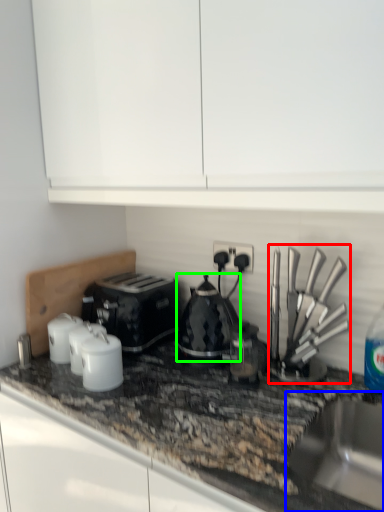
Question: Which object is the closest to the kitchen appliance (highlighted by a red box)? Choose among these: sink (highlighted by a blue box) or kitchen appliance (highlighted by a green box).

Choices:
 (A) sink
 (B) kitchen appliance

Answer: (A)